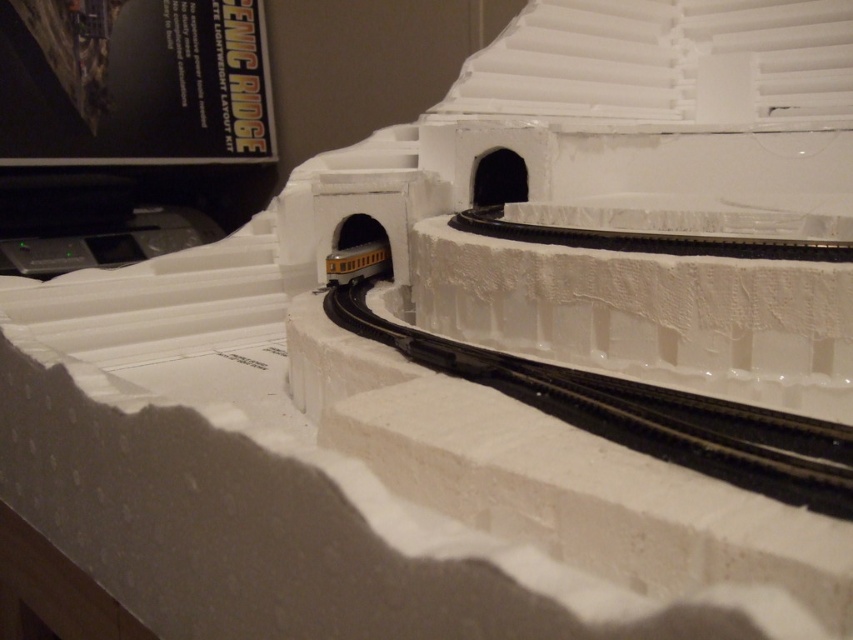
Question: In this image, where is black rubber train track at center located relative to yellow matte train at center?

Choices:
 (A) below
 (B) above

Answer: (A)

Question: Is black rubber train track at center closer to camera compared to yellow matte train at center?

Choices:
 (A) yes
 (B) no

Answer: (A)

Question: Which point is farther to the camera?

Choices:
 (A) black rubber train track at center
 (B) yellow matte train at center

Answer: (B)

Question: Is black rubber train track at center to the left of yellow matte train at center from the viewer's perspective?

Choices:
 (A) no
 (B) yes

Answer: (A)

Question: Which point is farther to the camera?

Choices:
 (A) yellow matte train at center
 (B) black rubber train track at center

Answer: (A)